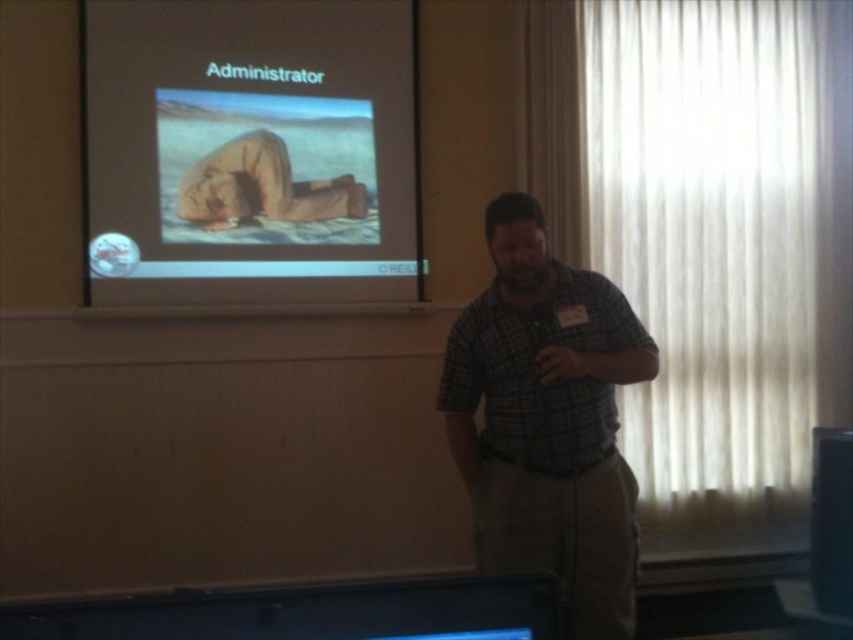
Question: Can you confirm if green plaid shirt at center is positioned to the right of tan fabric pants at center?

Choices:
 (A) yes
 (B) no

Answer: (A)

Question: Which object is the closest to the tan fabric pants at center?

Choices:
 (A) green plaid shirt at center
 (B) matte projector screen at upper left

Answer: (B)

Question: Is green plaid shirt at center bigger than tan fabric pants at center?

Choices:
 (A) yes
 (B) no

Answer: (A)

Question: Which of the following is the farthest from the observer?

Choices:
 (A) (231, 58)
 (B) (233, 189)
 (C) (456, 404)

Answer: (B)

Question: Does matte projector screen at upper left have a lesser width compared to tan fabric pants at center?

Choices:
 (A) no
 (B) yes

Answer: (A)

Question: Which point is closer to the camera taking this photo?

Choices:
 (A) (231, 154)
 (B) (393, 243)

Answer: (A)